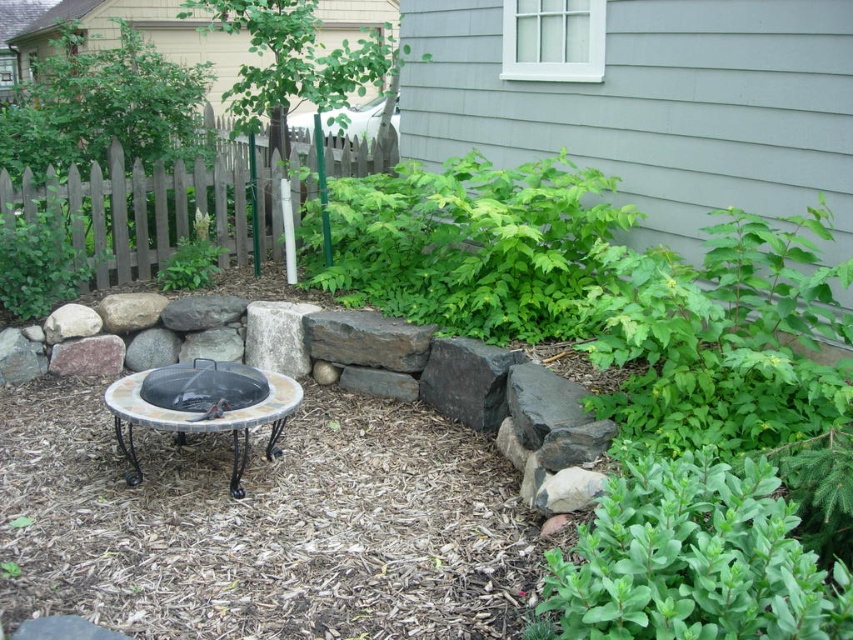
Question: Which point is farther to the camera?

Choices:
 (A) (422, 218)
 (B) (573, 602)
 (C) (264, 228)
 (D) (6, 230)

Answer: (C)

Question: Among these objects, which one is farthest from the camera?

Choices:
 (A) gray wood fence at upper left
 (B) green leafy plant at lower right

Answer: (A)

Question: Can you confirm if green leafy bush at center is positioned to the left of gray wood fence at upper left?

Choices:
 (A) yes
 (B) no

Answer: (B)

Question: Among these points, which one is farthest from the camera?

Choices:
 (A) (19, 205)
 (B) (334, 340)

Answer: (A)

Question: Observing the image, what is the correct spatial positioning of gray wood fence at upper left in reference to black mesh fire pit at center?

Choices:
 (A) left
 (B) right

Answer: (A)

Question: Does gray wood fence at upper left have a greater width compared to gray rough stone at center?

Choices:
 (A) no
 (B) yes

Answer: (B)